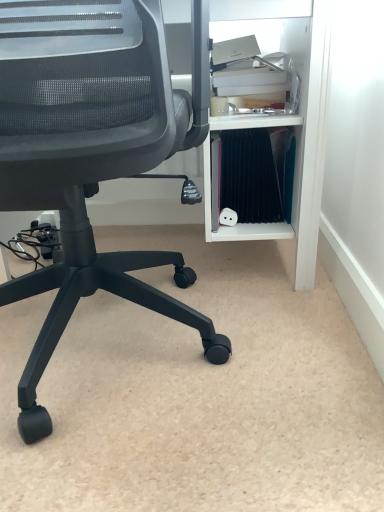
What do you see at coordinates (91, 154) in the screenshot?
I see `black mesh chair at left` at bounding box center [91, 154].

What is the approximate width of black mesh chair at left?

The width of black mesh chair at left is 57.69 centimeters.

What are the coordinates of `black mesh chair at left` in the screenshot? It's located at (91, 154).

Measure the distance between point (40, 426) and camera.

Point (40, 426) and camera are 27.48 inches apart.

Locate an element on the screen. The width and height of the screenshot is (384, 512). black mesh chair at left is located at coordinates (91, 154).